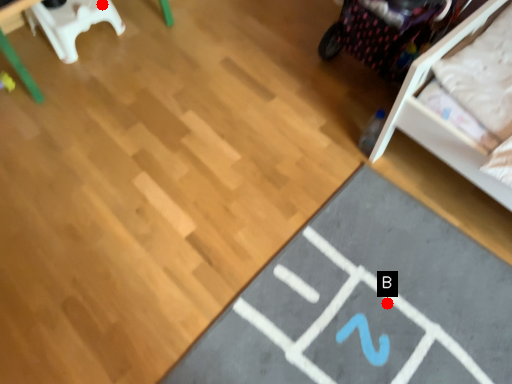
Question: Two points are circled on the image, labeled by A and B beside each circle. Which point appears closest to the camera in this image?

Choices:
 (A) A is closer
 (B) B is closer

Answer: (B)